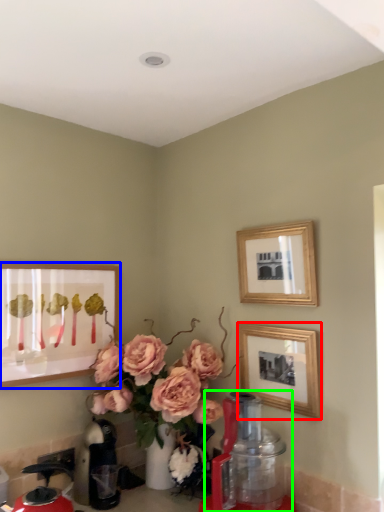
Question: Based on their relative distances, which object is nearer to picture frame (highlighted by a red box)? Choose from picture frame (highlighted by a blue box) and blender (highlighted by a green box).

Choices:
 (A) picture frame
 (B) blender

Answer: (B)